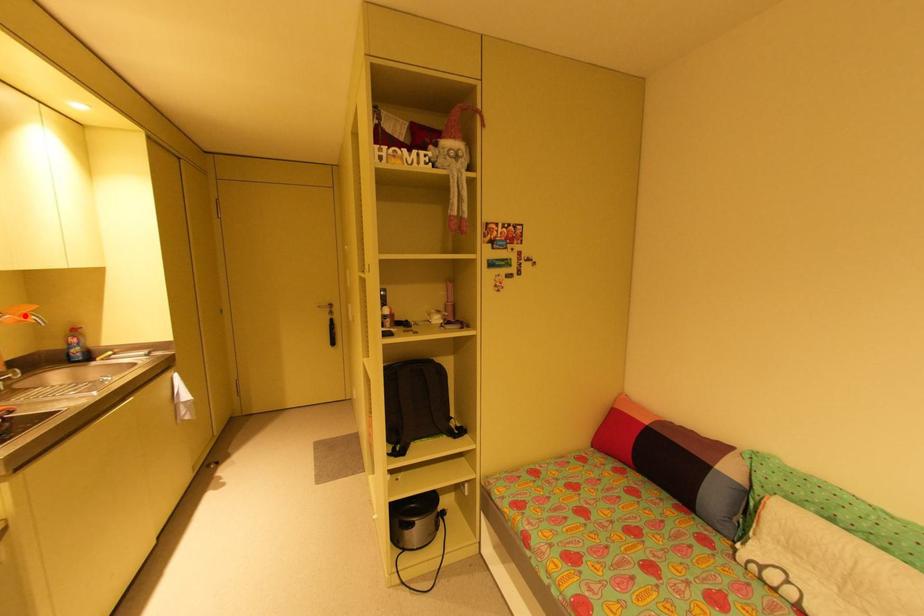
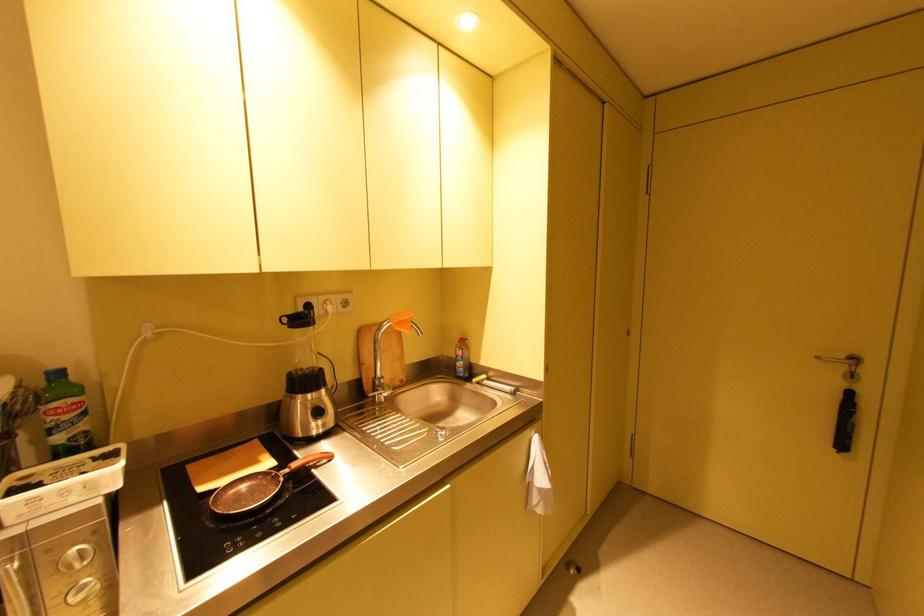
The point at the highlighted location is marked in the first image. Where is the corresponding point in the second image?

(400, 325)